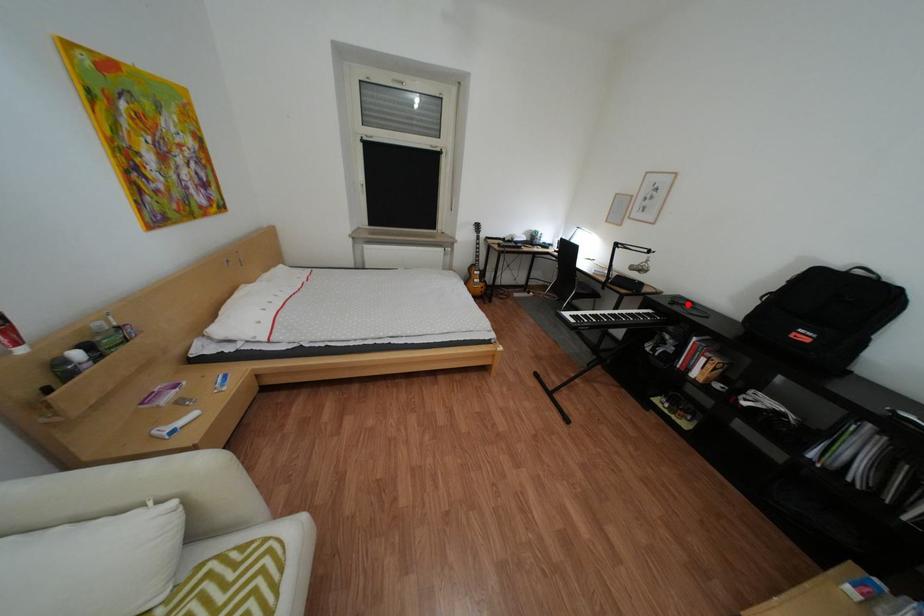
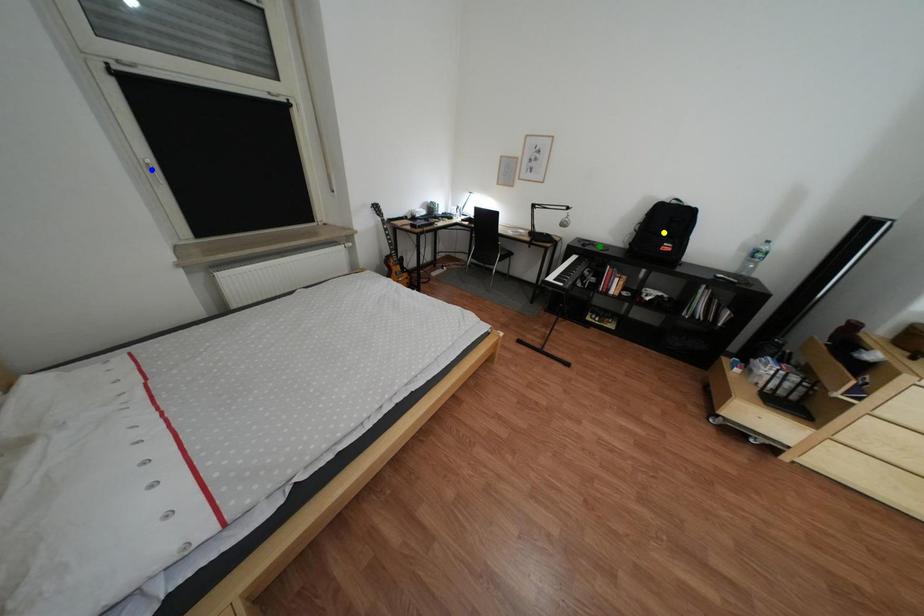
Question: I am providing you with two images of the same scene from different viewpoints. A red point is marked on the first image. You are given multiple points on the second image. Which point in image 2 is actually the same real-world point as the red point in image 1?

Choices:
 (A) yellow point
 (B) green point
 (C) blue point

Answer: (B)